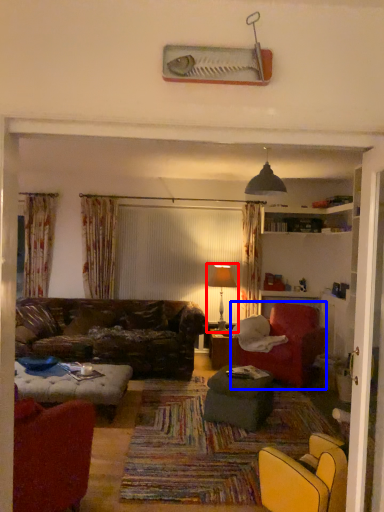
Question: Which object is closer to the camera taking this photo, table lamp (highlighted by a red box) or chair (highlighted by a blue box)?

Choices:
 (A) table lamp
 (B) chair

Answer: (B)